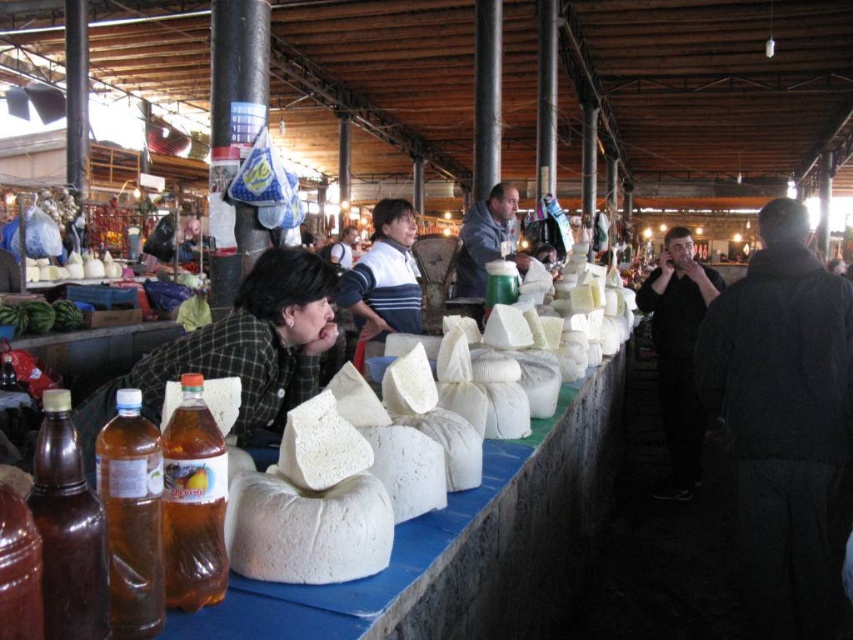
Question: Does black wool coat at right come behind gray hoodie at center?

Choices:
 (A) yes
 (B) no

Answer: (B)

Question: Which of these objects is positioned closest to the translucent plastic bottle at center?

Choices:
 (A) gray hoodie at center
 (B) brown glass bottle at left
 (C) black wool coat at right
 (D) translucent plastic bottle at lower left

Answer: (D)

Question: Which point is farther from the camera taking this photo?

Choices:
 (A) (459, 256)
 (B) (73, 435)
 (C) (329, 481)
 (D) (372, 212)

Answer: (A)

Question: Is translucent plastic bottle at center thinner than gray hoodie at center?

Choices:
 (A) yes
 (B) no

Answer: (A)

Question: Estimate the real-world distances between objects in this image. Which object is farther from the green plaid shirt at center?

Choices:
 (A) translucent plastic bottle at center
 (B) black matte jacket at right
 (C) white soft cheese at center
 (D) brown glass bottle at left

Answer: (B)

Question: Is white soft cheese at center to the right of green plaid shirt at center from the viewer's perspective?

Choices:
 (A) yes
 (B) no

Answer: (A)